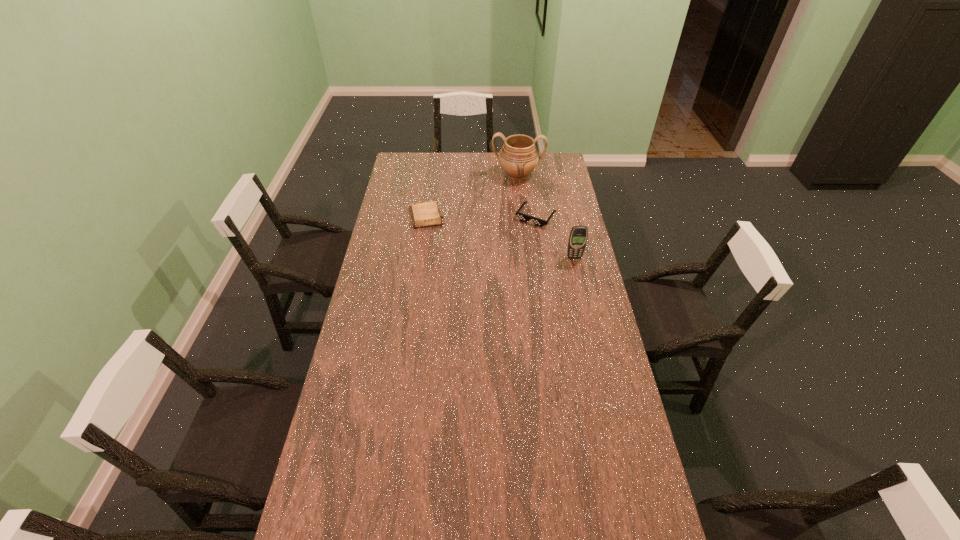
Where is `object that is at the far right corner`? The width and height of the screenshot is (960, 540). object that is at the far right corner is located at coordinates (518, 157).

This screenshot has width=960, height=540. In order to click on free space at the far edge of the desktop in this screenshot , I will do `click(495, 167)`.

This screenshot has height=540, width=960. In order to click on free space at the left edge in this screenshot , I will do `click(408, 181)`.

Identify the location of free space at the right edge of the desktop. The width and height of the screenshot is (960, 540). (565, 204).

Where is `vacant space at the near left corner of the desktop`? The image size is (960, 540). vacant space at the near left corner of the desktop is located at coordinates (328, 505).

At what (x,y) coordinates should I click in order to perform the action: click on vacant space at the far right corner. Please return your answer as a coordinate pair (x, y). Image resolution: width=960 pixels, height=540 pixels. Looking at the image, I should click on (555, 164).

Find the location of a particular element. The image size is (960, 540). vacant region at the near right corner is located at coordinates pos(652,501).

The width and height of the screenshot is (960, 540). What are the coordinates of `unoccupied position between the diary and the sunglasses` in the screenshot? It's located at (481, 217).

Where is `vacant point located between the cellular telephone and the leftmost object`? The image size is (960, 540). vacant point located between the cellular telephone and the leftmost object is located at coordinates (500, 237).

Locate an element on the screen. empty space that is in between the rightmost object and the tallest object is located at coordinates (546, 216).